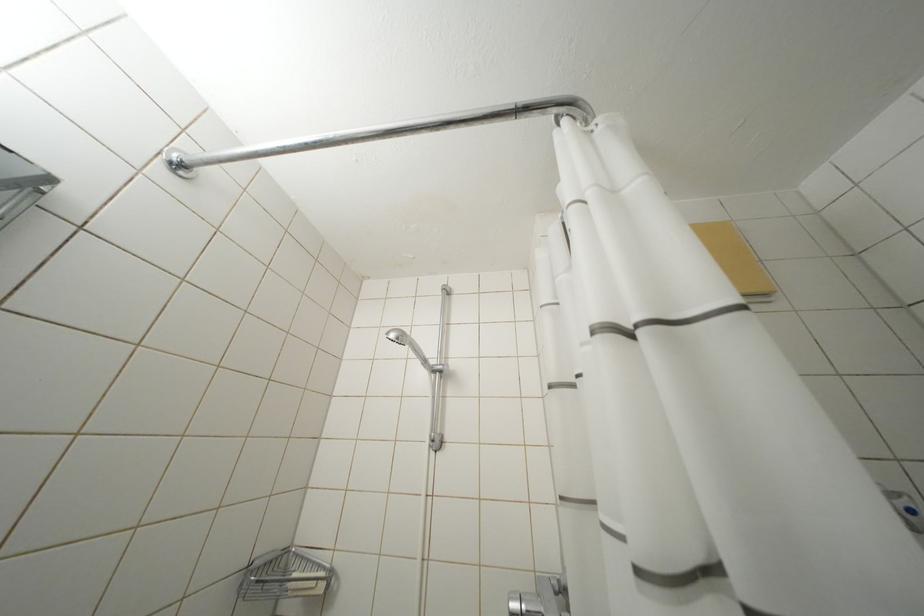
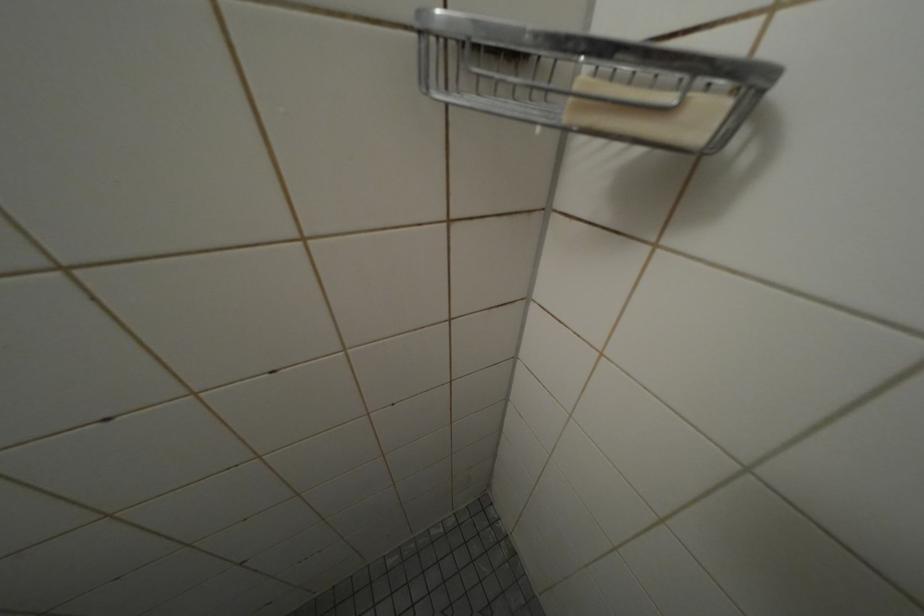
Based on the continuous images, in which direction is the camera rotating?

The camera rotated toward left-down.